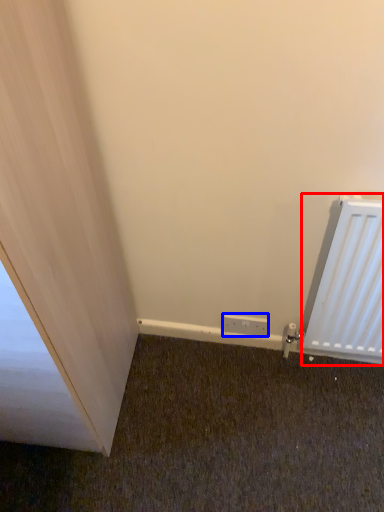
Question: Which object appears closest to the camera in this image, radiator (highlighted by a red box) or electric outlet (highlighted by a blue box)?

Choices:
 (A) radiator
 (B) electric outlet

Answer: (A)